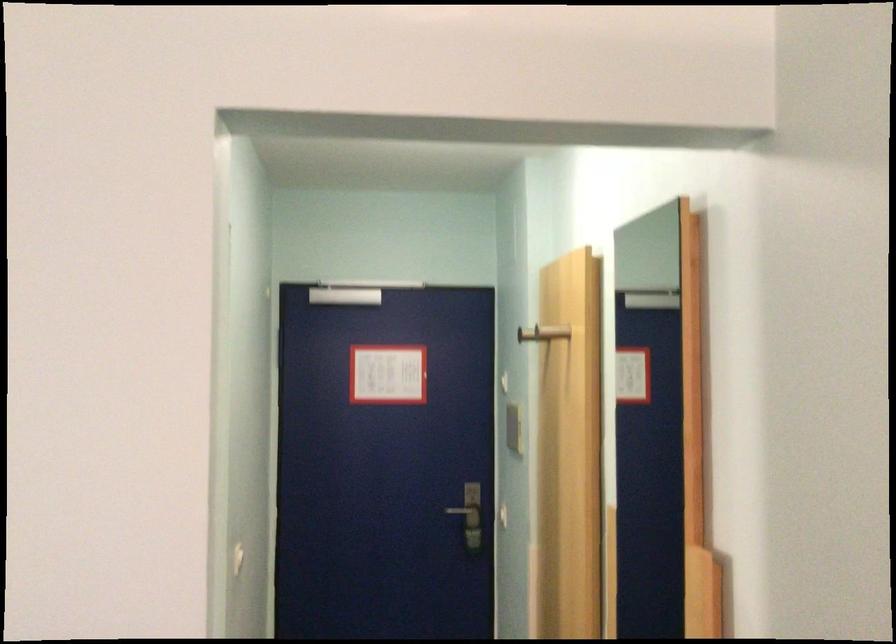
What do you see at coordinates (529, 334) in the screenshot? I see `a metal wall hook` at bounding box center [529, 334].